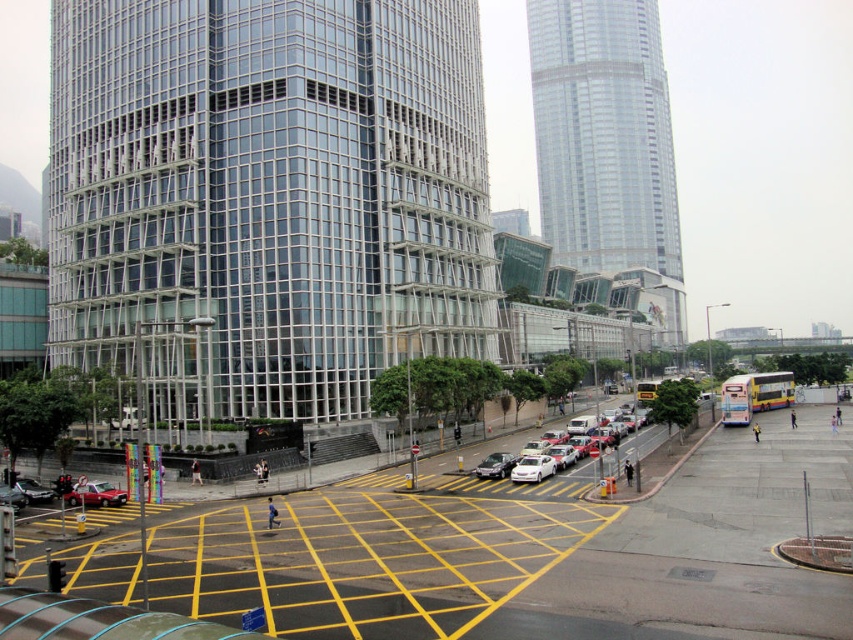
Question: Can you confirm if clear glass skyscraper at center is smaller than shiny silver sedan at center?

Choices:
 (A) yes
 (B) no

Answer: (B)

Question: In this image, where is clear glass skyscraper at center located relative to shiny black sedan at lower left?

Choices:
 (A) below
 (B) above

Answer: (B)

Question: Which of the following is the closest to the observer?

Choices:
 (A) shiny silver sedan at center
 (B) clear glass skyscraper at center
 (C) white glossy car at center
 (D) metallic silver car at lower left

Answer: (D)

Question: Which point is farther to the camera?

Choices:
 (A) white glossy sedan at center
 (B) metallic silver car at lower left

Answer: (A)

Question: Which point is closer to the camera?

Choices:
 (A) (335, 154)
 (B) (674, 204)

Answer: (A)

Question: Is glassy silver skyscraper at upper right below white glossy sedan at center?

Choices:
 (A) no
 (B) yes

Answer: (A)